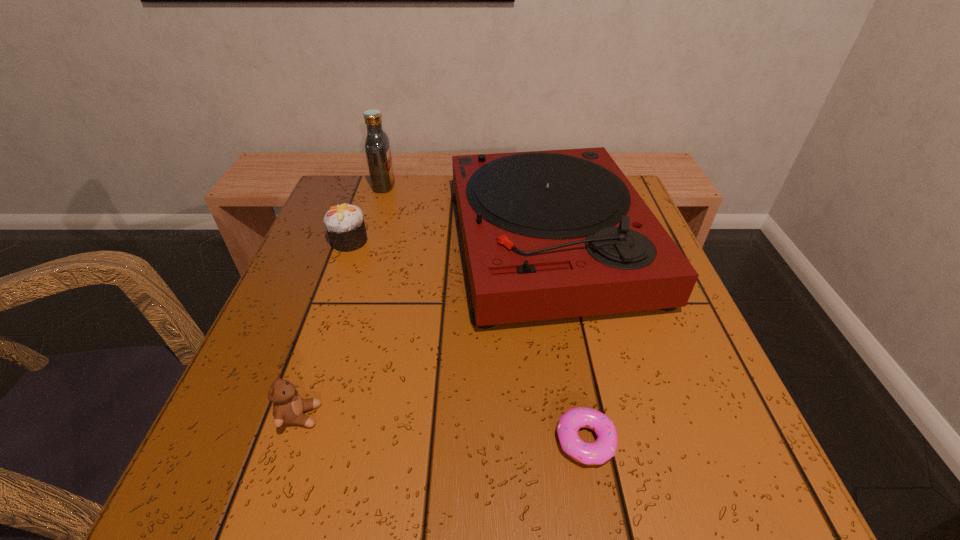
Locate an element on the screen. This screenshot has width=960, height=540. vodka that is at the far edge is located at coordinates (377, 146).

You are a GUI agent. You are given a task and a screenshot of the screen. Output one action in this format:
    pyautogui.click(x=<x>, y=<y>)
    Task: Click on the record player that is at the far edge
    The height and width of the screenshot is (540, 960).
    Given the screenshot: What is the action you would take?
    pyautogui.click(x=552, y=234)

At what (x,y) coordinates should I click in order to perform the action: click on object at the near edge. Please return your answer as a coordinate pair (x, y). The width and height of the screenshot is (960, 540). Looking at the image, I should click on (604, 448).

Image resolution: width=960 pixels, height=540 pixels. Identify the location of vodka located at the left edge. (377, 146).

What are the coordinates of `teddy bear positioned at the left edge` in the screenshot? It's located at (288, 407).

What are the coordinates of `cupcake situated at the left edge` in the screenshot? It's located at click(345, 225).

Image resolution: width=960 pixels, height=540 pixels. I want to click on object that is at the right edge, so click(x=552, y=234).

Where is `object that is positioned at the far left corner`? This screenshot has width=960, height=540. object that is positioned at the far left corner is located at coordinates (377, 146).

The width and height of the screenshot is (960, 540). I want to click on object situated at the far right corner, so click(552, 234).

Where is `free space at the near edge of the desktop`? This screenshot has width=960, height=540. free space at the near edge of the desktop is located at coordinates (466, 447).